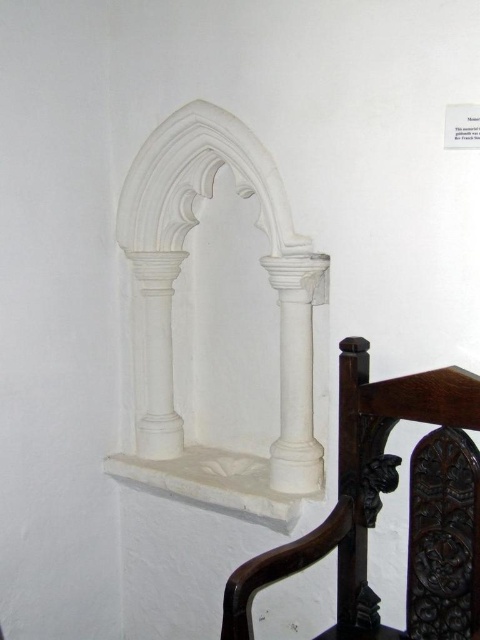
Based on the photo, you are standing in the historic building and want to place a small statue exactly at the midpoint between point (444, 522) and point (280, 342). Will the statue be closer to the niche or the chair?

The midpoint between point (444, 522) and point (280, 342) would be closer to the niche because point (444, 522) is in front of point (280, 342), meaning the midpoint leans towards the front position near the niche.

You are an interior designer assessing the space in the image. You need to determine if the brown carved wood chair at lower right can fit under the white marble column at center. Based on their sizes, can it fit?

The brown carved wood chair at lower right is much taller than the white marble column at center, so it cannot fit under the column as it would be too tall.